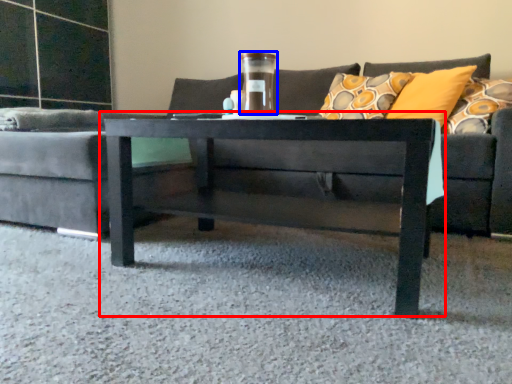
Question: Among these objects, which one is nearest to the camera, coffee table (highlighted by a red box) or glass vase (highlighted by a blue box)?

Choices:
 (A) coffee table
 (B) glass vase

Answer: (A)